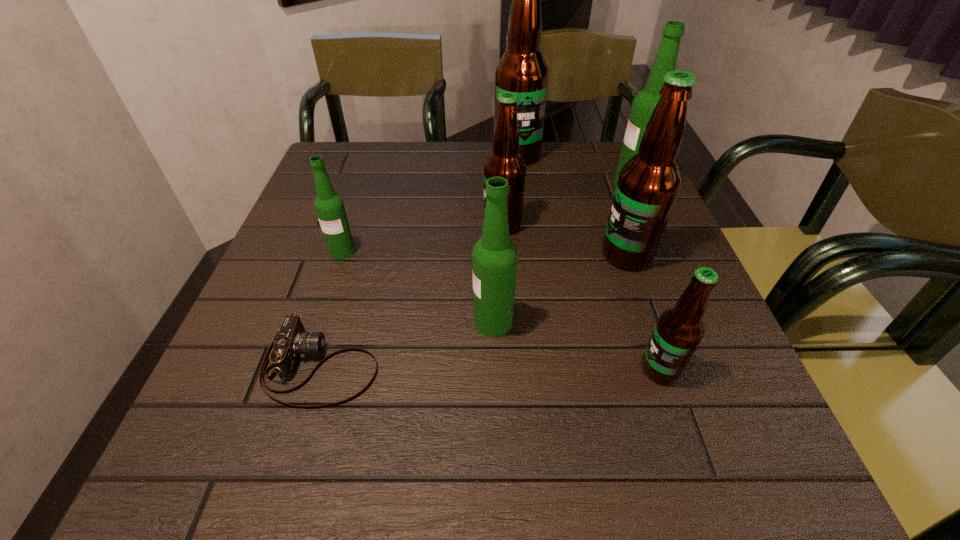
Locate an element on the screen. This screenshot has height=540, width=960. free location located on the label of the smallest brown beer bottle is located at coordinates (437, 369).

At what (x,y) coordinates should I click in order to perform the action: click on free space located on the label of the second farthest green beer bottle. Please return your answer as a coordinate pair (x, y). The image size is (960, 540). Looking at the image, I should click on (301, 375).

Find the location of a particular element. free space located 0.290m on the front-facing side of the shortest object is located at coordinates (551, 366).

Locate an element on the screen. beer bottle at the left edge is located at coordinates (329, 206).

Find the location of a particular element. This screenshot has height=540, width=960. camera that is at the left edge is located at coordinates [x=291, y=342].

The height and width of the screenshot is (540, 960). Identify the location of object that is at the far right corner. click(x=644, y=103).

What are the coordinates of `free region at the far edge of the desktop` in the screenshot? It's located at tap(444, 185).

At what (x,y) coordinates should I click in order to perform the action: click on vacant space at the near edge of the desktop. Please return your answer as a coordinate pair (x, y). The image size is (960, 540). Looking at the image, I should click on (527, 451).

The height and width of the screenshot is (540, 960). I want to click on free space at the left edge, so click(311, 331).

At what (x,y) coordinates should I click in order to perform the action: click on free space at the right edge. Please return your answer as a coordinate pair (x, y). Image resolution: width=960 pixels, height=540 pixels. Looking at the image, I should click on (667, 230).